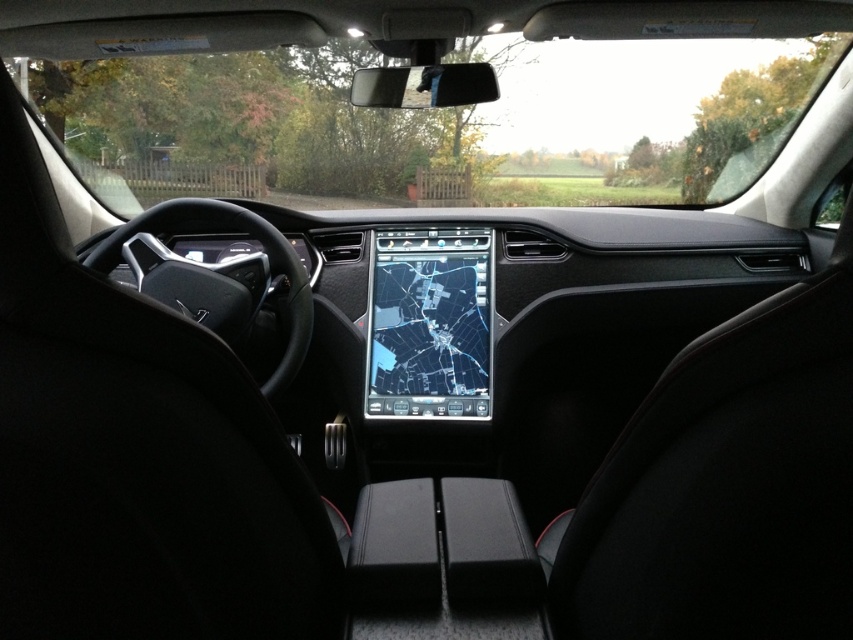
Question: Can you confirm if transparent glass windshield at upper center is smaller than shiny black touchscreen at center?

Choices:
 (A) yes
 (B) no

Answer: (B)

Question: Does transparent glass windshield at upper center appear on the right side of shiny black touchscreen at center?

Choices:
 (A) yes
 (B) no

Answer: (B)

Question: Which object appears farthest from the camera in this image?

Choices:
 (A) shiny black touchscreen at center
 (B) transparent glass windshield at upper center

Answer: (B)

Question: Can you confirm if transparent glass windshield at upper center is positioned below shiny black touchscreen at center?

Choices:
 (A) no
 (B) yes

Answer: (A)